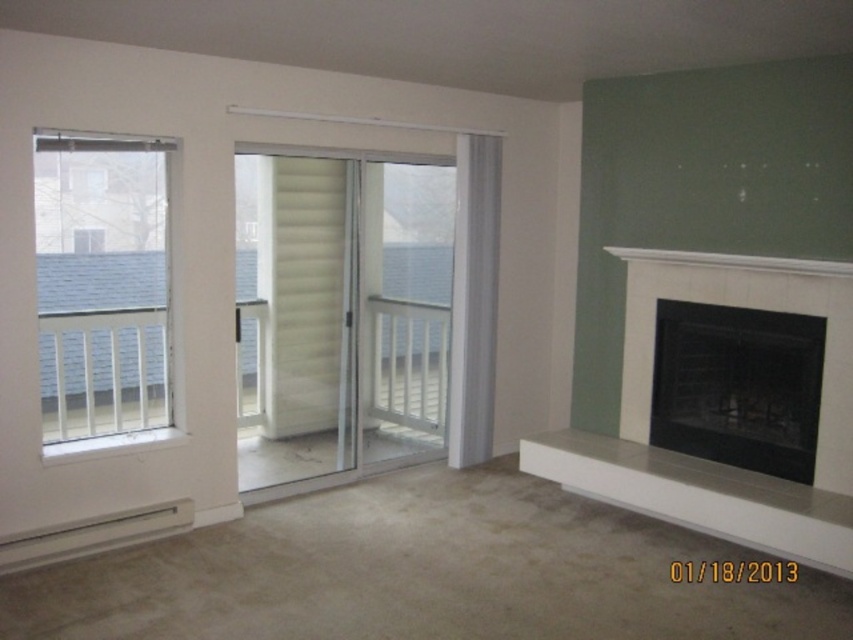
Question: Can you confirm if clear glass sliding door at center is bigger than white glossy sliding door at center?

Choices:
 (A) yes
 (B) no

Answer: (A)

Question: Among these points, which one is nearest to the camera?

Choices:
 (A) (82, 248)
 (B) (734, 518)

Answer: (B)

Question: Which point is closer to the camera?

Choices:
 (A) (680, 436)
 (B) (85, 307)
 (C) (619, 442)

Answer: (B)

Question: Is clear glass sliding door at center to the left of black glass fireplace at right from the viewer's perspective?

Choices:
 (A) yes
 (B) no

Answer: (A)

Question: Which point is closer to the camera taking this photo?

Choices:
 (A) (767, 417)
 (B) (367, 305)
 (C) (68, 205)

Answer: (C)

Question: Considering the relative positions of white wood window at left and black glass fireplace at right in the image provided, where is white wood window at left located with respect to black glass fireplace at right?

Choices:
 (A) right
 (B) left

Answer: (B)